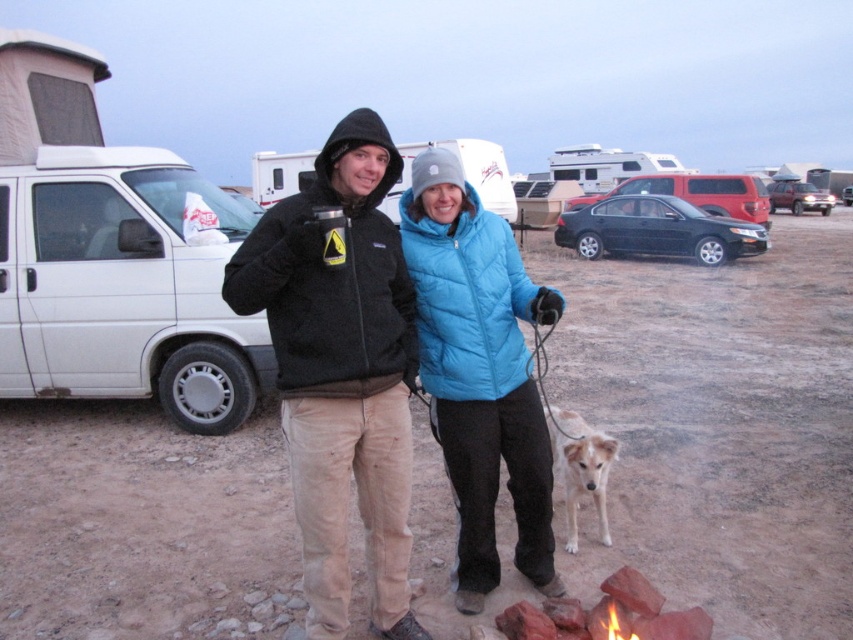
Does point (440, 182) come farther from viewer compared to point (735, 173)?

No, it is in front of (735, 173).

Is blue puffy vest at center to the left of satin black sedan at center from the viewer's perspective?

Correct, you'll find blue puffy vest at center to the left of satin black sedan at center.

Is point (538, 476) in front of point (657, 186)?

That is True.

Identify the location of blue puffy vest at center. The height and width of the screenshot is (640, 853). (479, 371).

Between point (358, 426) and point (605, 531), which one is positioned in front?

Point (358, 426) is more forward.

Can you confirm if matte black jacket at center is positioned below light brown fur at center?

No.

I want to click on matte black jacket at center, so click(x=341, y=369).

Based on the photo, which is more to the right, white matte van at left or satin black sedan at center?

From the viewer's perspective, satin black sedan at center appears more on the right side.

Can you confirm if white matte van at left is positioned to the right of satin black sedan at center?

In fact, white matte van at left is to the left of satin black sedan at center.

Which is in front, point (247, 413) or point (589, 195)?

Point (247, 413) is more forward.

I want to click on white matte van at left, so click(x=125, y=285).